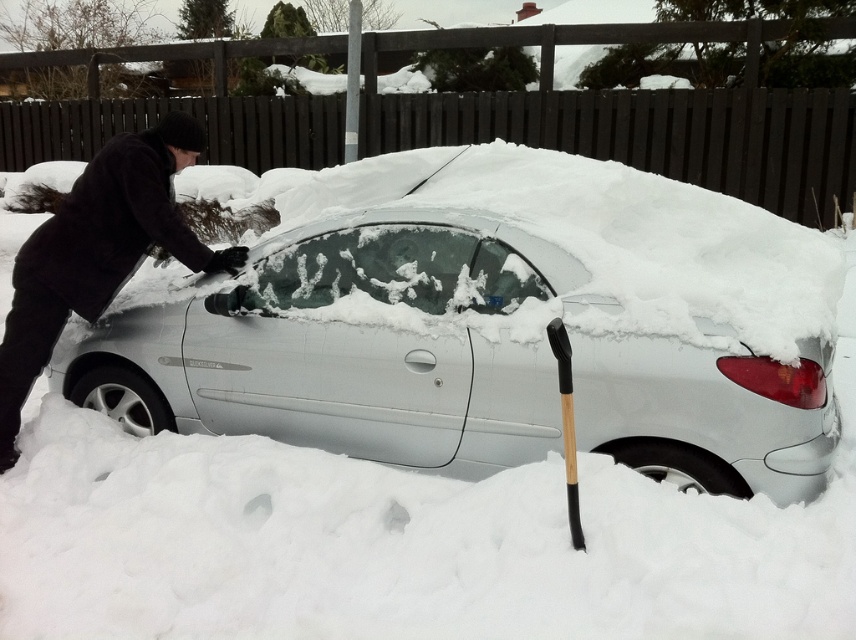
You are standing in the driveway and want to reach the point marked at coordinates (522, 262). If you take a step forward of 1.5 meters, will you be closer than 3 meters to that point?

The point at coordinates (522, 262) is initially 4.26 meters away. After stepping forward 1.5 meters, the distance becomes 4.26m minus 1.5m equals 2.76 meters, which is less than 3 meters. So yes, you will be closer than 3 meters.

From the picture: You are standing in the driveway and want to move the black woolen hat at upper left to the side so you can access the white matte car at center. Based on their positions, which direction should you move the hat relative to the car?

Since the white matte car at center is to the right of the black woolen hat at upper left, you should move the hat to the left relative to the car to access it.

You are a delivery driver who needs to park your white matte car at center in a narrow alley that is only as wide as the black wood shovel at lower right. Based on the scene, can your car fit into the alley?

The white matte car at center is wider than the black wood shovel at lower right, so the car cannot fit into the alley that is only as wide as the shovel.